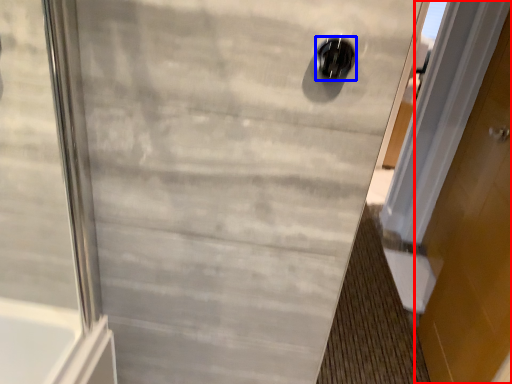
Question: Which point is closer to the camera, door (highlighted by a red box) or hole (highlighted by a blue box)?

Choices:
 (A) door
 (B) hole

Answer: (B)